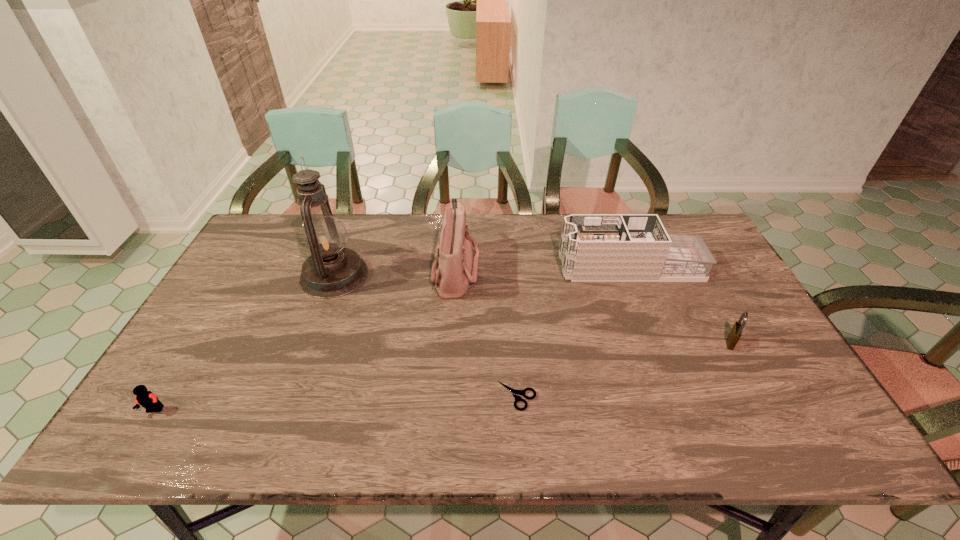
This screenshot has height=540, width=960. What are the coordinates of `free space located 0.160m on the right of the oil lamp` in the screenshot? It's located at (420, 275).

The image size is (960, 540). I want to click on free space located 0.190m on the front pocket of the shoulder bag, so click(539, 269).

At what (x,y) coordinates should I click in order to perform the action: click on vacant space located 0.310m at the entrance of the fourth shortest object. Please return your answer as a coordinate pair (x, y). Looking at the image, I should click on (463, 267).

At what (x,y) coordinates should I click in order to perform the action: click on vacant region located at the entrance of the fourth shortest object. Please return your answer as a coordinate pair (x, y). Looking at the image, I should click on (492, 267).

I want to click on blank space located 0.150m at the entrance of the fourth shortest object, so click(514, 267).

Find the location of `vacant region located 0.170m on the front of the third nearest object`. vacant region located 0.170m on the front of the third nearest object is located at coordinates (766, 408).

The height and width of the screenshot is (540, 960). Find the location of `vacant space located on the front-facing side of the Lego`. vacant space located on the front-facing side of the Lego is located at coordinates (138, 437).

What are the coordinates of `free space located on the left of the fourth object from left to right` in the screenshot? It's located at (464, 396).

Find the location of a particular element. The height and width of the screenshot is (540, 960). oil lamp located at the far edge is located at coordinates (331, 271).

Locate an element on the screen. The image size is (960, 540). shoulder bag positioned at the far edge is located at coordinates (454, 270).